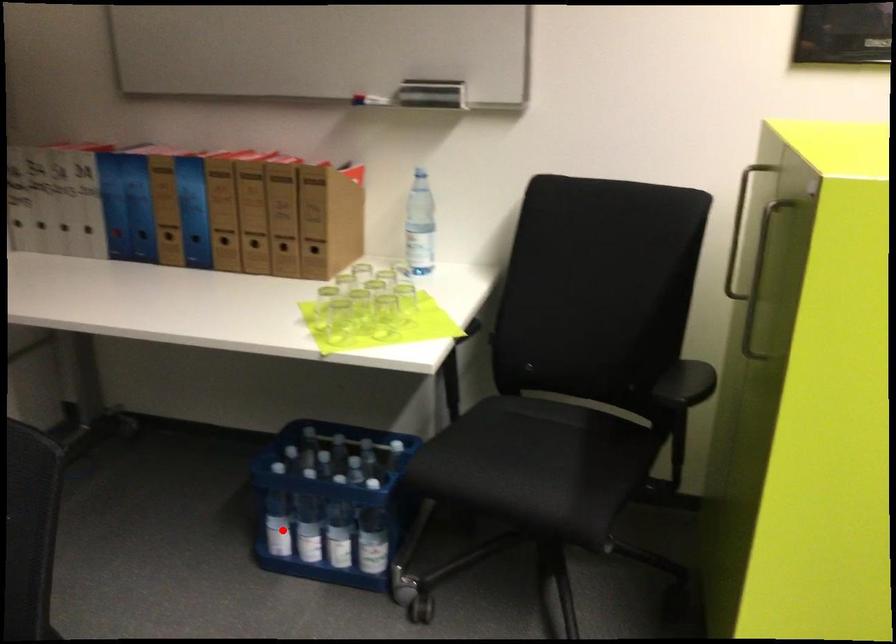
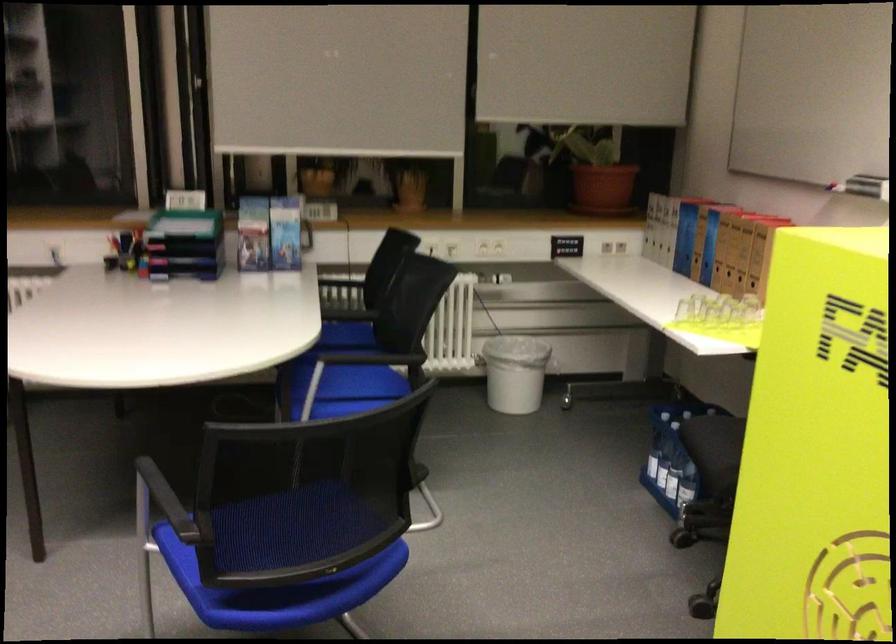
In the second image, find the point that corresponds to the highlighted location in the first image.

(650, 458)